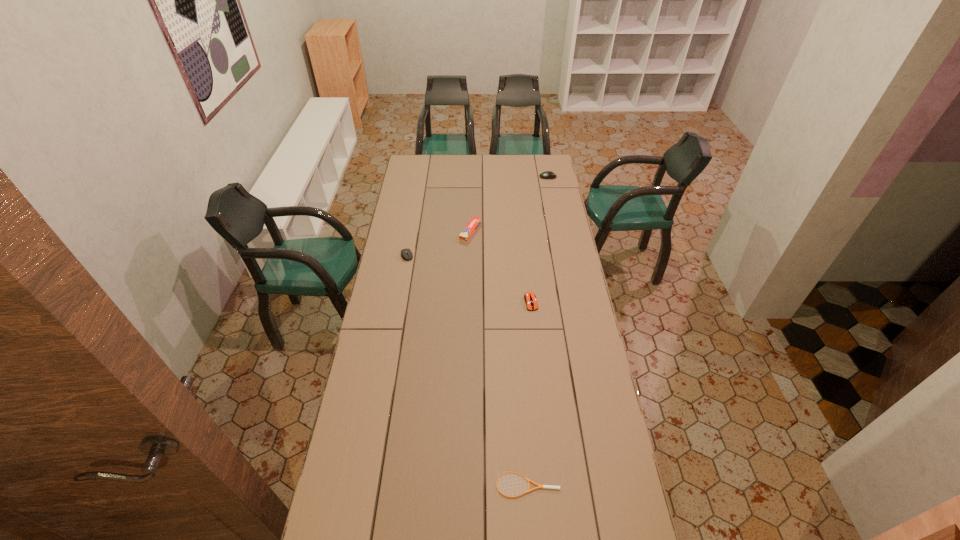
The height and width of the screenshot is (540, 960). I want to click on object located in the far right corner section of the desktop, so click(x=548, y=174).

Locate an element on the screen. This screenshot has width=960, height=540. blank space at the far edge is located at coordinates (437, 156).

Image resolution: width=960 pixels, height=540 pixels. What are the coordinates of `vacant space at the left edge` in the screenshot? It's located at (396, 217).

Where is `vacant space at the right edge`? This screenshot has height=540, width=960. vacant space at the right edge is located at coordinates click(x=554, y=259).

The width and height of the screenshot is (960, 540). In the image, there is a desktop. Find the location of `vacant space at the far left corner`. vacant space at the far left corner is located at coordinates (416, 164).

Find the location of a particular element. The image size is (960, 540). empty location between the nearest computer mouse and the tennis racket is located at coordinates (529, 394).

Image resolution: width=960 pixels, height=540 pixels. What are the coordinates of `empty location between the second nearest computer mouse and the rightmost computer mouse` in the screenshot? It's located at (477, 216).

You are a GUI agent. You are given a task and a screenshot of the screen. Output one action in this format:
    pyautogui.click(x=<x>, y=<y>)
    Task: Click on the vacant area that lies between the second computer mouse from right to left and the rightmost object
    The width and height of the screenshot is (960, 540).
    Given the screenshot: What is the action you would take?
    pyautogui.click(x=540, y=240)

Identify the location of vacant area that lies between the second nearest object and the fourth nearest object. The height and width of the screenshot is (540, 960). (501, 267).

The width and height of the screenshot is (960, 540). I want to click on free spot between the leftmost object and the tennis racket, so click(x=468, y=370).